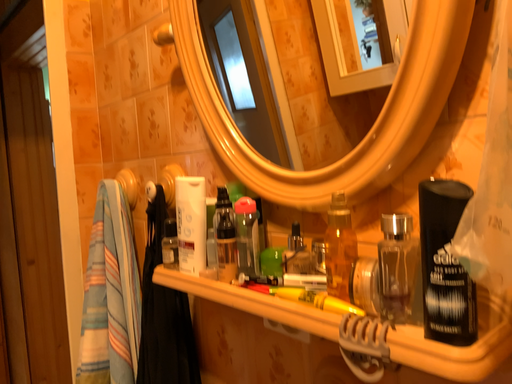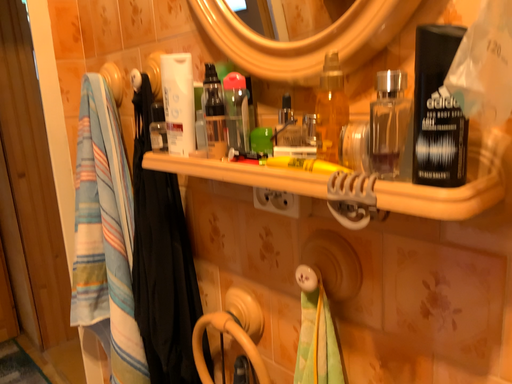
Question: Which way did the camera rotate in the video?

Choices:
 (A) rotated upward
 (B) rotated downward

Answer: (B)